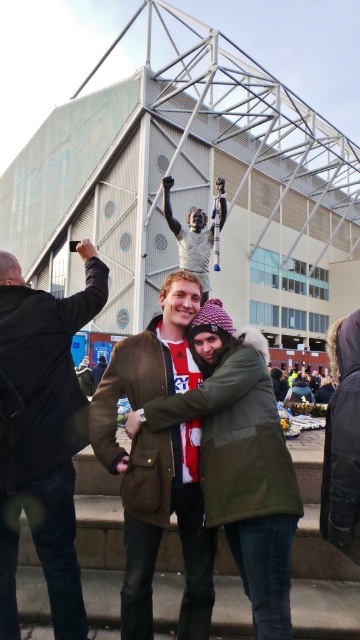
Question: Among these points, which one is farthest from the camera?

Choices:
 (A) (24, 376)
 (B) (110, 380)

Answer: (B)

Question: Does dark brown leather jacket at upper left have a lesser width compared to brown suede jacket at center?

Choices:
 (A) yes
 (B) no

Answer: (A)

Question: Does dark brown leather jacket at upper left have a lesser width compared to brown suede jacket at center?

Choices:
 (A) no
 (B) yes

Answer: (B)

Question: Among these points, which one is nearest to the camera?

Choices:
 (A) (92, 259)
 (B) (102, 376)

Answer: (A)

Question: Which point is farther to the camera?

Choices:
 (A) (146, 339)
 (B) (56, 314)

Answer: (B)

Question: Can you confirm if dark brown leather jacket at upper left is positioned to the right of brown suede jacket at center?

Choices:
 (A) yes
 (B) no

Answer: (B)